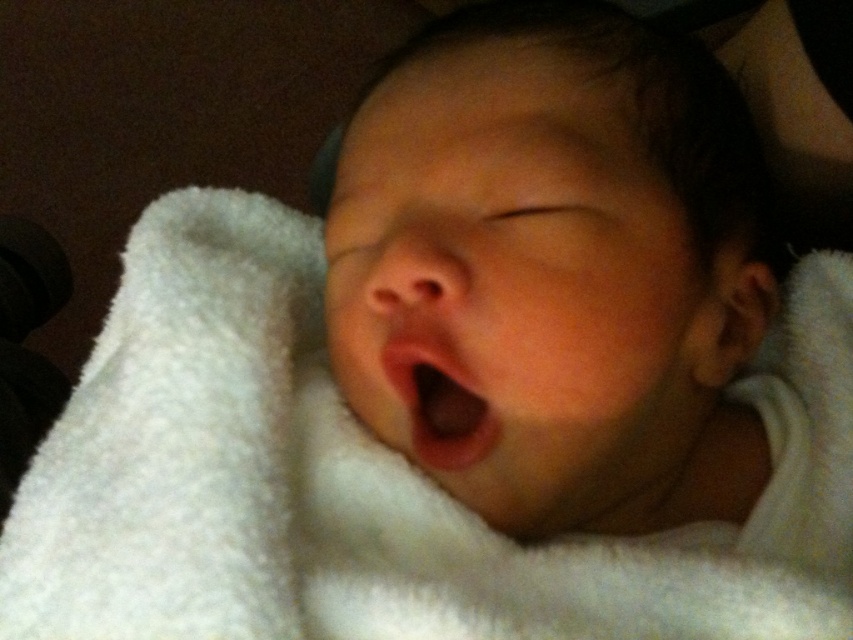
Question: Is white fluffy blanket at center to the left of pink smooth flesh at center from the viewer's perspective?

Choices:
 (A) no
 (B) yes

Answer: (A)

Question: Can you confirm if white fluffy blanket at center is wider than pink smooth flesh at center?

Choices:
 (A) no
 (B) yes

Answer: (B)

Question: Is the position of white fluffy blanket at center less distant than that of pink smooth flesh at center?

Choices:
 (A) yes
 (B) no

Answer: (A)

Question: Which point is closer to the camera?

Choices:
 (A) white fluffy blanket at center
 (B) pink smooth flesh at center

Answer: (A)